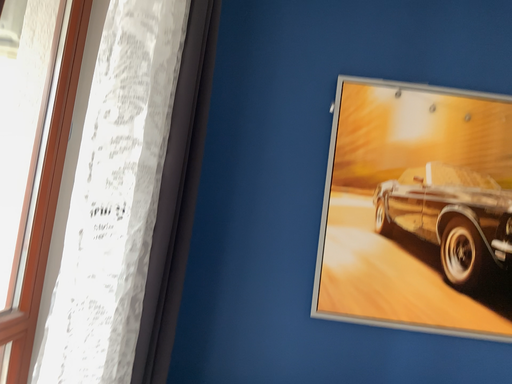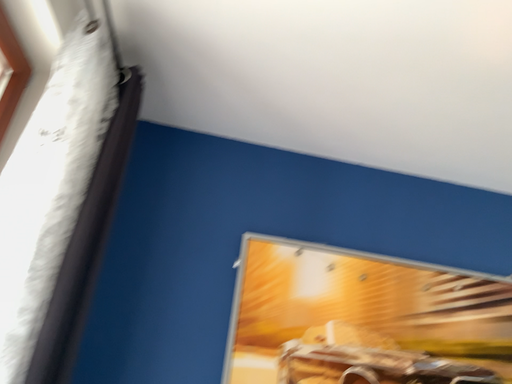
Question: Which way did the camera rotate in the video?

Choices:
 (A) rotated downward
 (B) rotated upward

Answer: (B)